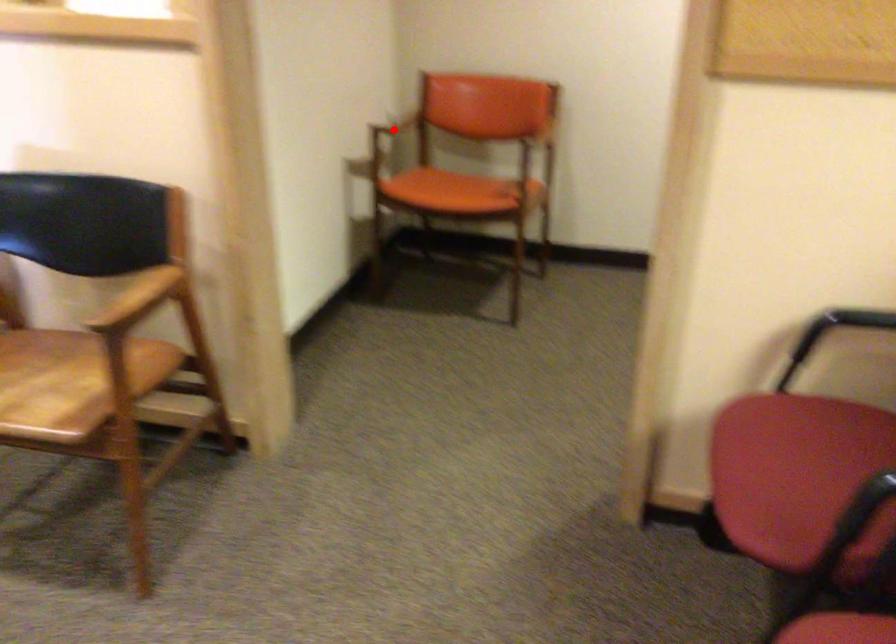
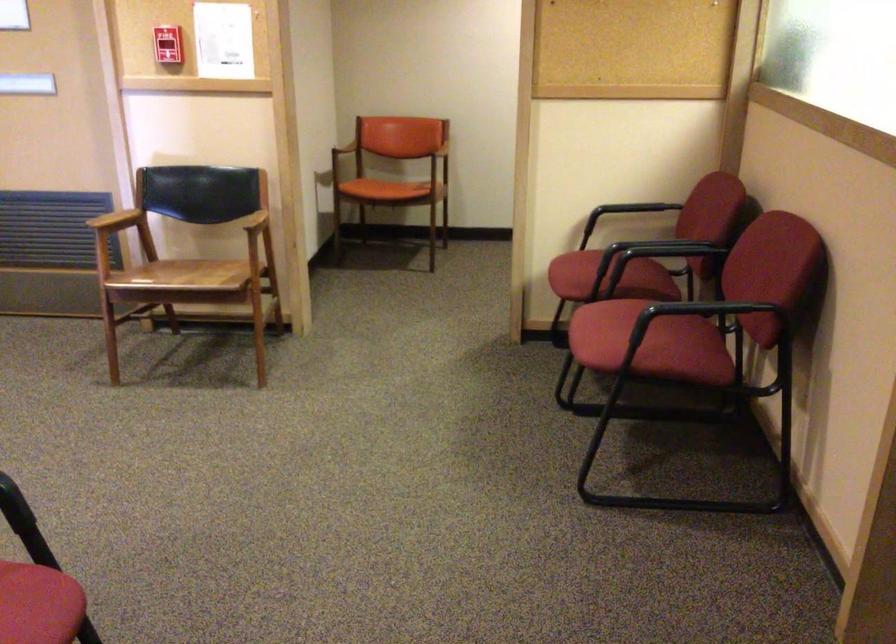
In the second image, find the point that corresponds to the highlighted location in the first image.

(345, 147)